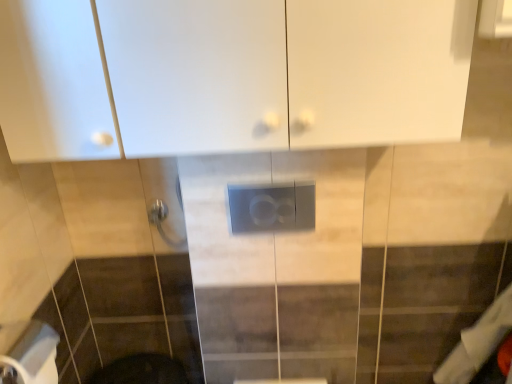
The height and width of the screenshot is (384, 512). I want to click on satin gray panel at center, so click(271, 207).

Describe the element at coordinates (271, 207) in the screenshot. Image resolution: width=512 pixels, height=384 pixels. I see `satin gray panel at center` at that location.

Find the location of a particular element. The height and width of the screenshot is (384, 512). white glossy cabinet at upper center is located at coordinates (285, 71).

Can you tell me how much satin gray panel at center and white glossy cabinet at upper center differ in facing direction?

0.419 degrees separate the facing orientations of satin gray panel at center and white glossy cabinet at upper center.

Considering the relative positions of satin gray panel at center and white glossy cabinet at upper center in the image provided, is satin gray panel at center behind white glossy cabinet at upper center?

Yes, it is.

Is satin gray panel at center next to white glossy cabinet at upper center and touching it?

satin gray panel at center is not next to white glossy cabinet at upper center, and they're not touching.

From a real-world perspective, is satin gray panel at center above or below white glossy cabinet at upper center?

satin gray panel at center is below white glossy cabinet at upper center.

Would you say white matte toilet paper at lower left is outside satin gray panel at center?

white matte toilet paper at lower left lies outside satin gray panel at center's area.

Considering the points (28, 364) and (248, 192), which point is in front, point (28, 364) or point (248, 192)?

Point (248, 192)

You are a GUI agent. You are given a task and a screenshot of the screen. Output one action in this format:
    pyautogui.click(x=<x>, y=<y>)
    Task: Click on the electric outlet behind the white matte toilet paper at lower left
    This screenshot has width=512, height=384.
    Given the screenshot: What is the action you would take?
    pyautogui.click(x=271, y=207)

Considering the sizes of objects white matte toilet paper at lower left and satin gray panel at center in the image provided, who is smaller, white matte toilet paper at lower left or satin gray panel at center?

Smaller between the two is satin gray panel at center.

Who is taller, white matte toilet paper at lower left or white glossy cabinet at upper center?

Standing taller between the two is white glossy cabinet at upper center.

Image resolution: width=512 pixels, height=384 pixels. I want to click on cabinetry in front of the white matte toilet paper at lower left, so click(x=285, y=71).

Does point (41, 382) lie in front of point (275, 71)?

No, (41, 382) is further to viewer.

Which of these two, satin gray panel at center or white matte toilet paper at lower left, is bigger?

Bigger between the two is white matte toilet paper at lower left.

Is satin gray panel at center shorter than white matte toilet paper at lower left?

Indeed, satin gray panel at center has a lesser height compared to white matte toilet paper at lower left.

Is satin gray panel at center outside of white matte toilet paper at lower left?

Yes.

Is satin gray panel at center next to white matte toilet paper at lower left?

They are not placed beside each other.

From a real-world perspective, who is located lower, white glossy cabinet at upper center or satin gray panel at center?

satin gray panel at center is physically lower.

Based on the photo, which is behind, white glossy cabinet at upper center or satin gray panel at center?

satin gray panel at center is more distant.

Can you confirm if white glossy cabinet at upper center is shorter than satin gray panel at center?

In fact, white glossy cabinet at upper center may be taller than satin gray panel at center.

At what (x,y) coordinates should I click in order to perform the action: click on electric outlet directly beneath the white glossy cabinet at upper center (from a real-world perspective). Please return your answer as a coordinate pair (x, y). This screenshot has height=384, width=512. Looking at the image, I should click on (271, 207).

Between white glossy cabinet at upper center and white matte toilet paper at lower left, which one has larger width?

Wider between the two is white glossy cabinet at upper center.

Which is in front, point (149, 83) or point (1, 339)?

Positioned in front is point (149, 83).

This screenshot has width=512, height=384. What are the coordinates of `toilet paper lying behind the white glossy cabinet at upper center` in the screenshot? It's located at (28, 353).

Find the location of a particular element. cabinetry located on the left of satin gray panel at center is located at coordinates (285, 71).

Locate an element on the screen. electric outlet located above the white matte toilet paper at lower left (from the image's perspective) is located at coordinates (271, 207).

Based on their spatial positions, is satin gray panel at center or white matte toilet paper at lower left further from white glossy cabinet at upper center?

Among the two, white matte toilet paper at lower left is located further to white glossy cabinet at upper center.

Based on their spatial positions, is white glossy cabinet at upper center or satin gray panel at center further from white matte toilet paper at lower left?

Based on the image, white glossy cabinet at upper center appears to be further to white matte toilet paper at lower left.

Which object lies nearer to the anchor point satin gray panel at center, white glossy cabinet at upper center or white matte toilet paper at lower left?

white glossy cabinet at upper center is positioned closer to the anchor satin gray panel at center.

Estimate the real-world distances between objects in this image. Which object is closer to satin gray panel at center, white matte toilet paper at lower left or white glossy cabinet at upper center?

The object closer to satin gray panel at center is white glossy cabinet at upper center.

Looking at this image, estimate the real-world distances between objects in this image. Which object is closer to white matte toilet paper at lower left, satin gray panel at center or white glossy cabinet at upper center?

Based on the image, satin gray panel at center appears to be nearer to white matte toilet paper at lower left.

Looking at the image, which one is located further to white glossy cabinet at upper center, white matte toilet paper at lower left or satin gray panel at center?

white matte toilet paper at lower left.

Locate an element on the screen. electric outlet between white glossy cabinet at upper center and white matte toilet paper at lower left from top to bottom is located at coordinates (271, 207).